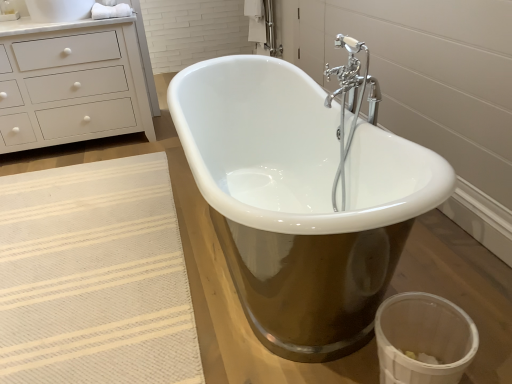
Question: Does white cotton towel at upper left turn towards white matte chest of drawers at upper left?

Choices:
 (A) yes
 (B) no

Answer: (B)

Question: Does white cotton towel at upper left have a smaller size compared to white matte chest of drawers at upper left?

Choices:
 (A) yes
 (B) no

Answer: (A)

Question: Is white cotton towel at upper left positioned before white matte chest of drawers at upper left?

Choices:
 (A) yes
 (B) no

Answer: (B)

Question: Considering the relative sizes of white cotton towel at upper left and white matte chest of drawers at upper left in the image provided, is white cotton towel at upper left bigger than white matte chest of drawers at upper left?

Choices:
 (A) no
 (B) yes

Answer: (A)

Question: Considering the relative positions of white cotton towel at upper left and white matte chest of drawers at upper left in the image provided, is white cotton towel at upper left behind white matte chest of drawers at upper left?

Choices:
 (A) no
 (B) yes

Answer: (B)

Question: Based on their positions, is white glossy bathtub at center located to the left or right of white cotton towel at upper left?

Choices:
 (A) right
 (B) left

Answer: (A)

Question: Considering the positions of white glossy bathtub at center and white cotton towel at upper left in the image, is white glossy bathtub at center bigger or smaller than white cotton towel at upper left?

Choices:
 (A) small
 (B) big

Answer: (B)

Question: Considering the positions of point (303, 261) and point (103, 6), is point (303, 261) closer or farther from the camera than point (103, 6)?

Choices:
 (A) farther
 (B) closer

Answer: (B)

Question: Is white glossy bathtub at center wider or thinner than white cotton towel at upper left?

Choices:
 (A) thin
 (B) wide

Answer: (B)

Question: In terms of width, does beige woven rug at lower left look wider or thinner when compared to white cotton towel at upper left?

Choices:
 (A) wide
 (B) thin

Answer: (A)

Question: From a real-world perspective, relative to white cotton towel at upper left, is beige woven rug at lower left vertically above or below?

Choices:
 (A) above
 (B) below

Answer: (B)

Question: Is beige woven rug at lower left inside the boundaries of white cotton towel at upper left, or outside?

Choices:
 (A) outside
 (B) inside

Answer: (A)

Question: Considering their positions, is beige woven rug at lower left located in front of or behind white cotton towel at upper left?

Choices:
 (A) behind
 (B) front

Answer: (B)

Question: In terms of width, does beige woven rug at lower left look wider or thinner when compared to white matte chest of drawers at upper left?

Choices:
 (A) wide
 (B) thin

Answer: (A)

Question: Considering the positions of beige woven rug at lower left and white matte chest of drawers at upper left in the image, is beige woven rug at lower left taller or shorter than white matte chest of drawers at upper left?

Choices:
 (A) short
 (B) tall

Answer: (A)